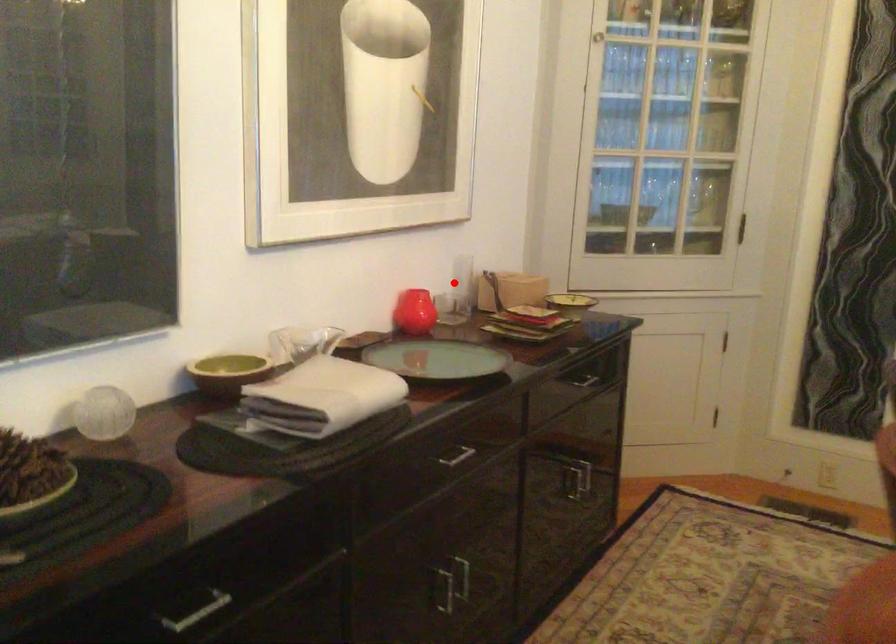
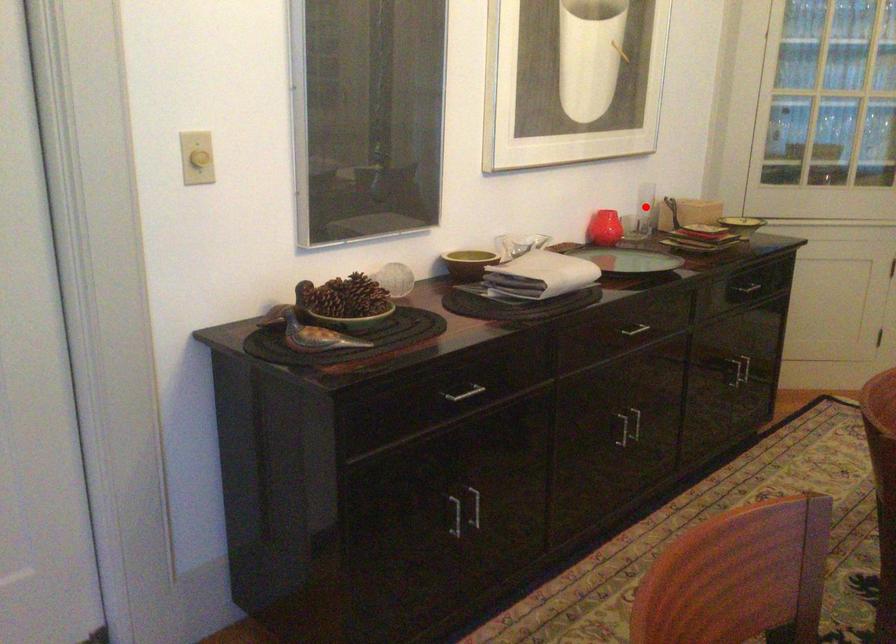
I am providing you with two images of the same scene from different viewpoints. A red point is marked on the first image and another point is marked on the second image. Does the point marked in image1 correspond to the same location as the one in image2?

Yes